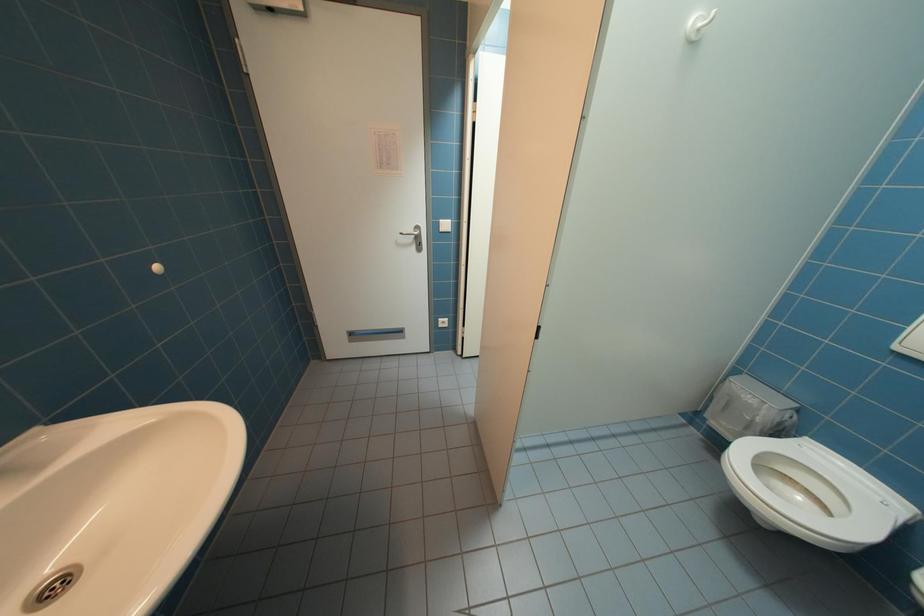
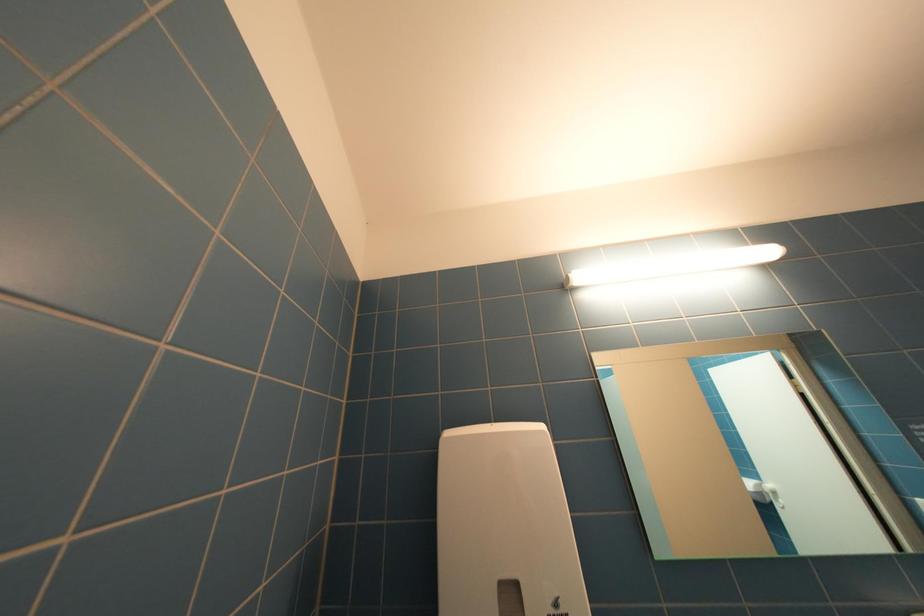
First-person continuous shooting, in which direction is the camera rotating?

The camera's rotation is toward left-up.